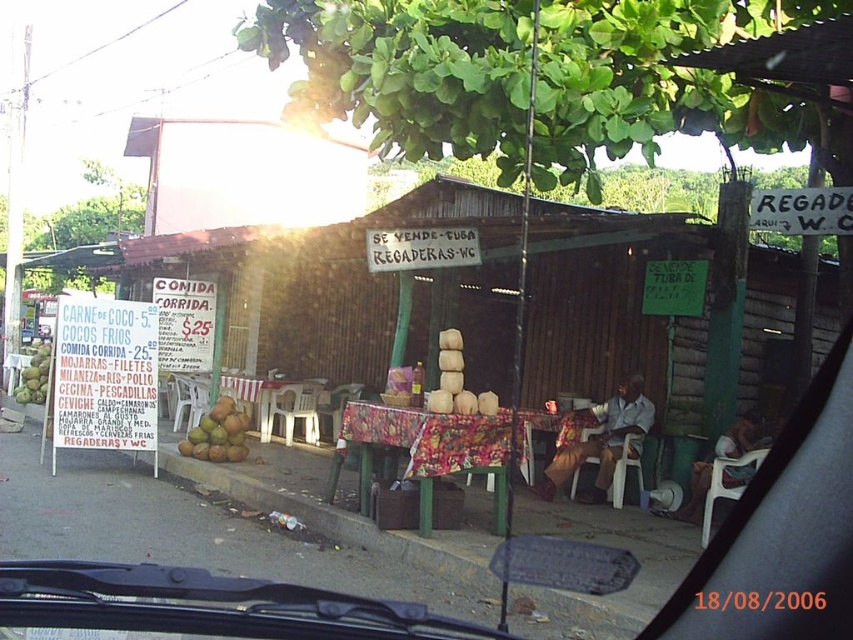
Question: Can you confirm if floral fabric-covered table at center is smaller than green coconut at left?

Choices:
 (A) yes
 (B) no

Answer: (B)

Question: Which point is farther to the camera?

Choices:
 (A) (33, 387)
 (B) (375, 628)

Answer: (A)

Question: Can you confirm if transparent rubber windshield at center is positioned to the left of floral fabric-covered table at center?

Choices:
 (A) yes
 (B) no

Answer: (A)

Question: Among these points, which one is farthest from the camera?

Choices:
 (A) (421, 433)
 (B) (241, 451)

Answer: (B)

Question: Which point is farther from the camera taking this photo?

Choices:
 (A) (125, 611)
 (B) (202, 428)
 (C) (474, 429)

Answer: (B)

Question: Does green matte coconuts at center appear on the right side of green coconut at left?

Choices:
 (A) yes
 (B) no

Answer: (A)